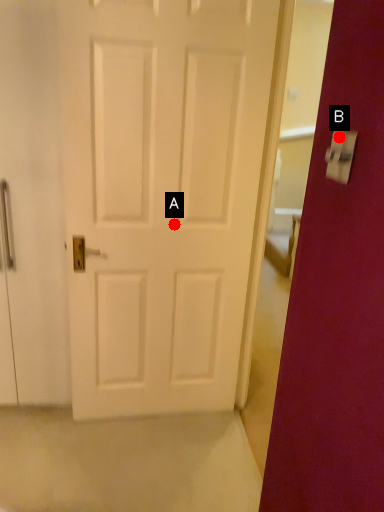
Question: Two points are circled on the image, labeled by A and B beside each circle. Which of the following is the closest to the observer?

Choices:
 (A) A is closer
 (B) B is closer

Answer: (B)